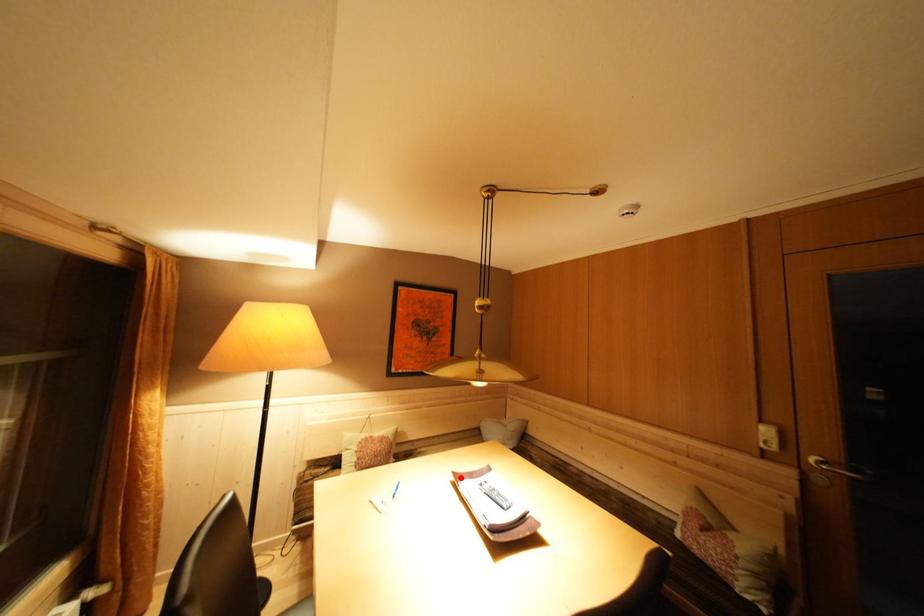
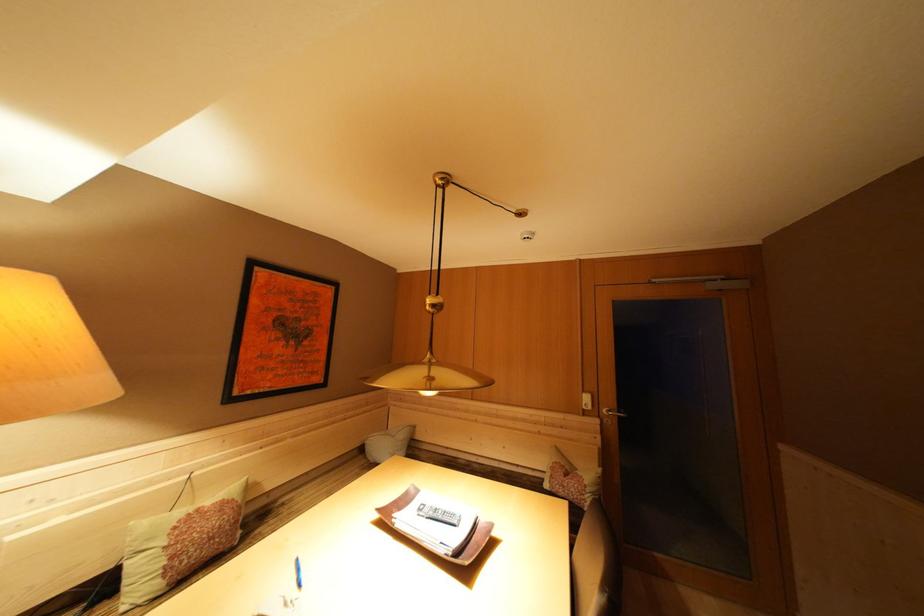
Find the pixel in the second image that matches the highlighted location in the first image.

(384, 515)